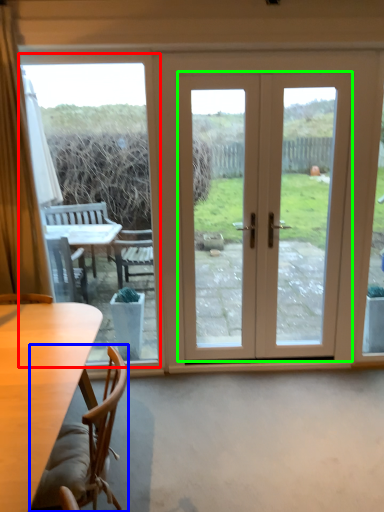
Question: Based on their relative distances, which object is farther from window screen (highlighted by a red box)? Choose from chair (highlighted by a blue box) and door (highlighted by a green box).

Choices:
 (A) chair
 (B) door

Answer: (B)